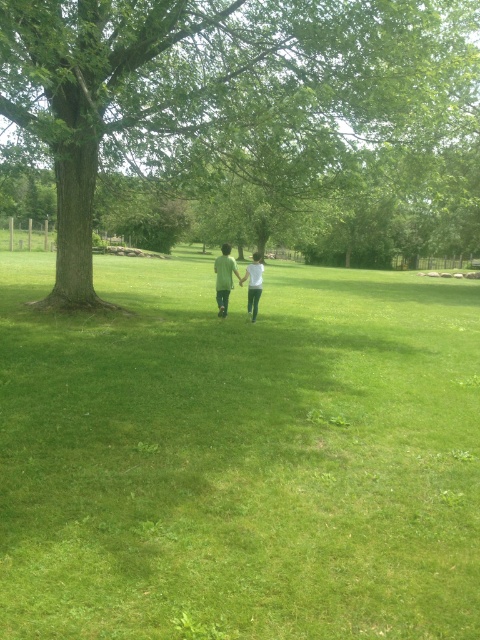
Between point (144, 490) and point (257, 301), which one is positioned in front?

Point (144, 490) is more forward.

Does point (47, 326) lie behind point (259, 260)?

No.

Describe the element at coordinates (240, 456) in the screenshot. I see `green grassy field at center` at that location.

Locate an element on the screen. The width and height of the screenshot is (480, 640). green grassy field at center is located at coordinates (240, 456).

Based on the photo, is green grassy field at center wider than green matte shirt at center?

Yes, green grassy field at center is wider than green matte shirt at center.

Based on the photo, who is higher up, green grassy field at center or green matte shirt at center?

Positioned higher is green matte shirt at center.

Image resolution: width=480 pixels, height=640 pixels. In order to click on green grassy field at center in this screenshot , I will do `click(240, 456)`.

The image size is (480, 640). What are the coordinates of `green grassy field at center` in the screenshot? It's located at (240, 456).

Which of these two, green rough bark tree at center or green matte shirt at center, stands taller?

green rough bark tree at center is taller.

Can you confirm if green rough bark tree at center is positioned to the left of green matte shirt at center?

Indeed, green rough bark tree at center is positioned on the left side of green matte shirt at center.

Who is more forward, (230,8) or (219,269)?

Positioned in front is point (230,8).

Image resolution: width=480 pixels, height=640 pixels. I want to click on green rough bark tree at center, so click(248, 124).